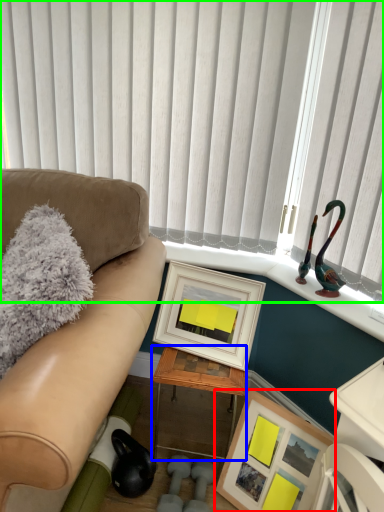
Question: Which is farther away from picture frame (highlighted by a red box)? table (highlighted by a blue box) or window blind (highlighted by a green box)?

Choices:
 (A) table
 (B) window blind

Answer: (B)